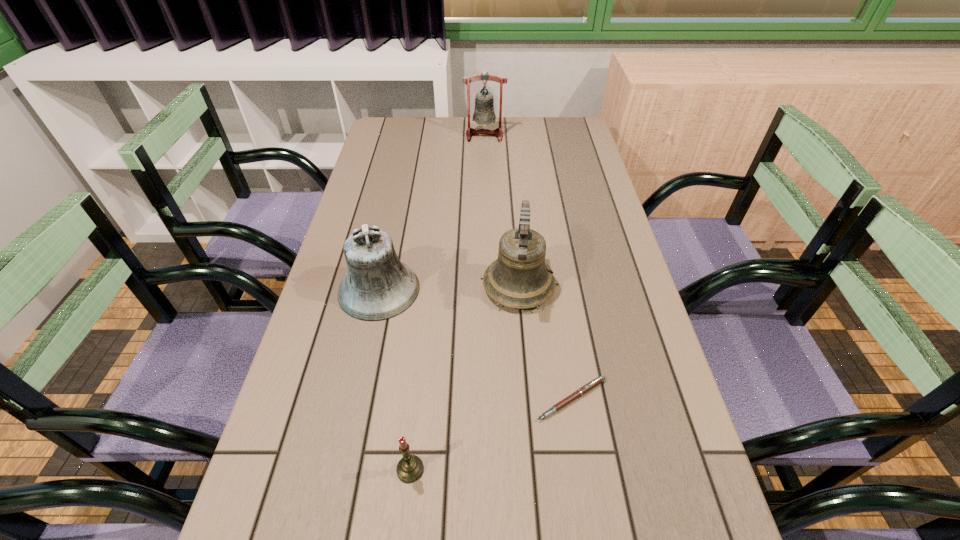
Find the location of a particular element. This screenshot has width=960, height=540. object that is at the far edge is located at coordinates pyautogui.click(x=484, y=113).

What are the coordinates of `object present at the left edge` in the screenshot? It's located at (378, 286).

The height and width of the screenshot is (540, 960). I want to click on object that is at the right edge, so click(592, 384).

The height and width of the screenshot is (540, 960). In order to click on vacant space at the far edge of the desktop in this screenshot , I will do `click(542, 147)`.

The width and height of the screenshot is (960, 540). Identify the location of vacant space at the left edge of the desktop. (366, 167).

The width and height of the screenshot is (960, 540). I want to click on free point at the right edge, so click(x=632, y=289).

You are a GUI agent. You are given a task and a screenshot of the screen. Output one action in this format:
    pyautogui.click(x=<x>, y=<y>)
    Task: Click on the free space at the far left corner of the desktop
    The height and width of the screenshot is (540, 960).
    Given the screenshot: What is the action you would take?
    pyautogui.click(x=379, y=144)

In the image, there is a desktop. In order to click on vacant space at the far right corner in this screenshot , I will do `click(571, 120)`.

This screenshot has width=960, height=540. I want to click on free space between the leftmost object and the pen, so click(475, 345).

Locate an element on the screen. vacant point located between the leftmost object and the candle is located at coordinates (395, 380).